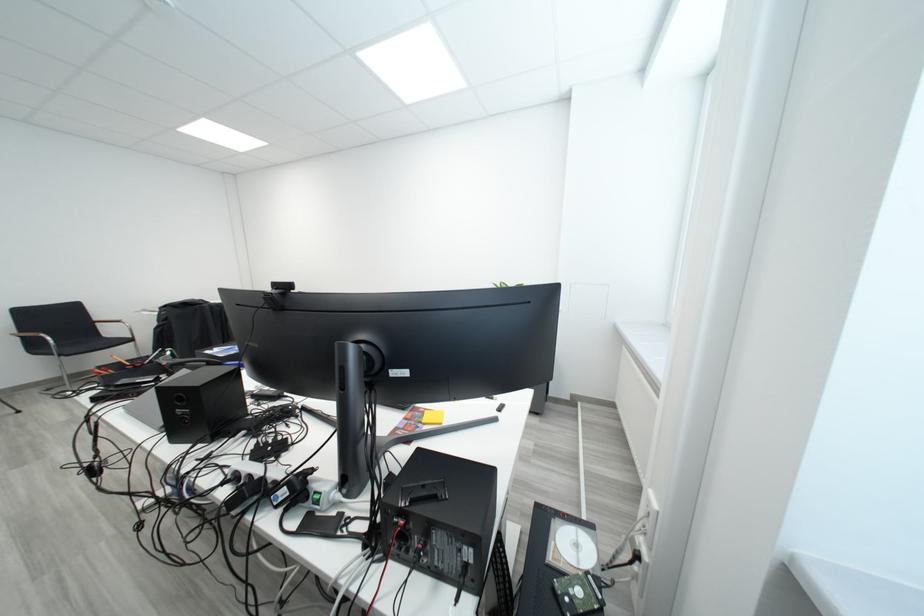
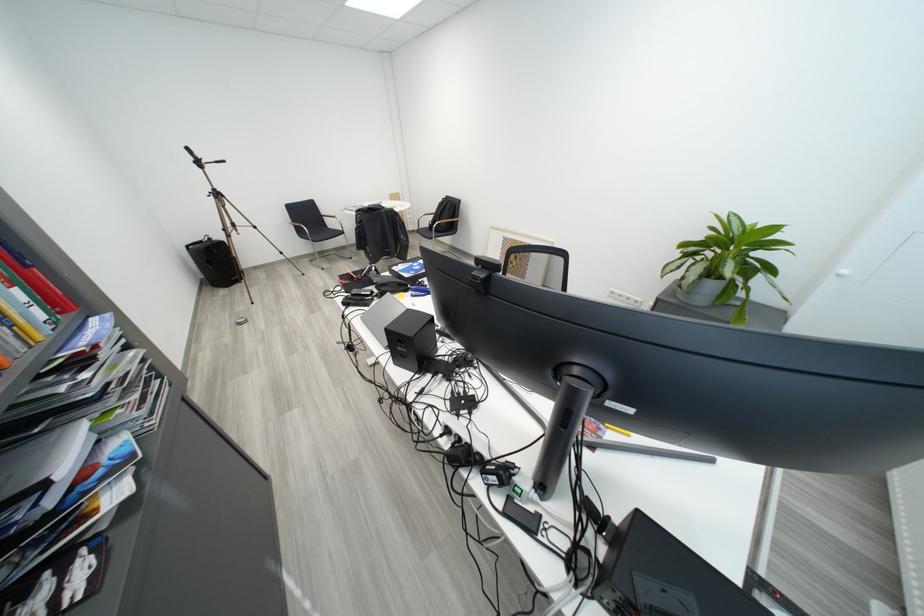
The images are taken continuously from a first-person perspective. In which direction is your viewpoint rotating?

The camera's rotation is toward left-down.